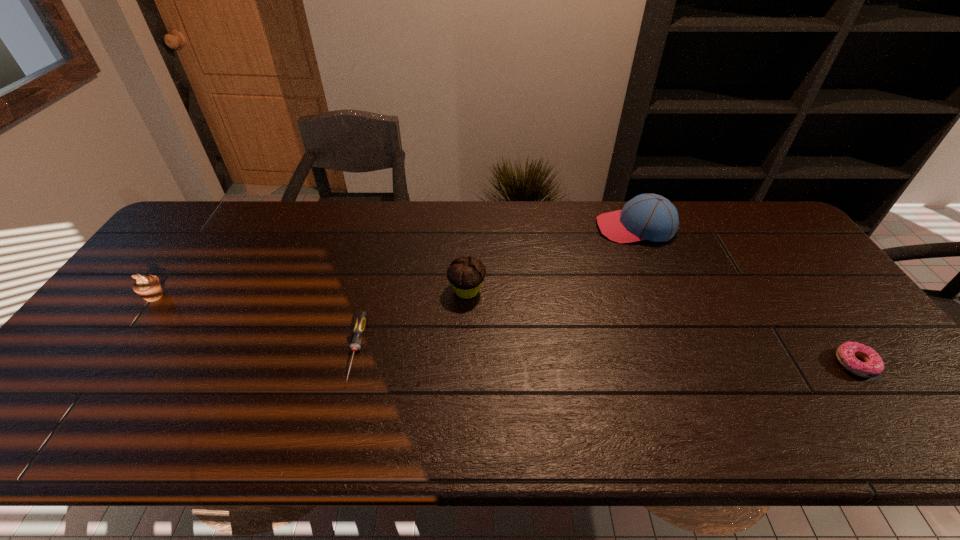
Locate an element on the screen. This screenshot has width=960, height=540. free space located 0.090m on the front-facing side of the baseball cap is located at coordinates (569, 228).

Find the location of `vacant space located 0.290m on the front-facing side of the baseball cap`. vacant space located 0.290m on the front-facing side of the baseball cap is located at coordinates (509, 228).

The image size is (960, 540). Identify the location of vacant space situated on the left of the right muffin. (370, 291).

Locate an element on the screen. The width and height of the screenshot is (960, 540). free space located on the right of the leftmost object is located at coordinates pyautogui.click(x=288, y=296).

The width and height of the screenshot is (960, 540). I want to click on blank area located on the left of the rightmost object, so [x=696, y=364].

I want to click on free region located insert the shortest object into a screw head, so click(337, 430).

I want to click on object situated at the far edge, so click(652, 217).

Image resolution: width=960 pixels, height=540 pixels. Identify the location of object present at the left edge. (149, 287).

I want to click on object at the right edge, so click(x=873, y=365).

Identify the location of free space at the far edge of the desktop. (552, 202).